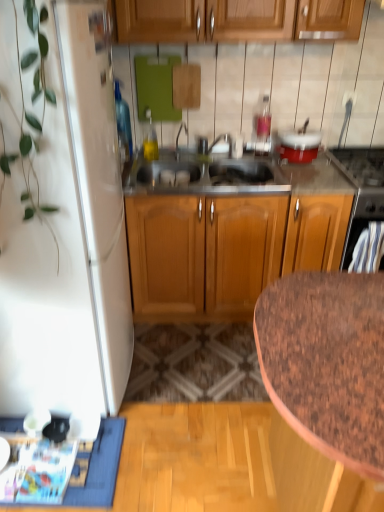
Question: From the image's perspective, is blue fabric doormat at lower left above or below black glass stove at upper right, positioned as the 2th appliance in left-to-right order?

Choices:
 (A) below
 (B) above

Answer: (A)

Question: In the image, is blue fabric doormat at lower left positioned in front of or behind black glass stove at upper right, which ranks as the 1th appliance in right-to-left order?

Choices:
 (A) behind
 (B) front

Answer: (B)

Question: Which object is the closest to the red glossy pot at upper right, which ranks as the 2th appliance in right-to-left order?

Choices:
 (A) blue fabric doormat at lower left
 (B) black glass stove at upper right, positioned as the 2th appliance in left-to-right order
 (C) white matte refrigerator at left
 (D) brown speckled granite at lower right

Answer: (B)

Question: Considering the real-world distances, which object is farthest from the black glass stove at upper right, positioned as the 2th appliance in left-to-right order?

Choices:
 (A) brown speckled granite at lower right
 (B) white matte refrigerator at left
 (C) red glossy pot at upper right, which ranks as the 2th appliance in right-to-left order
 (D) blue fabric doormat at lower left

Answer: (D)